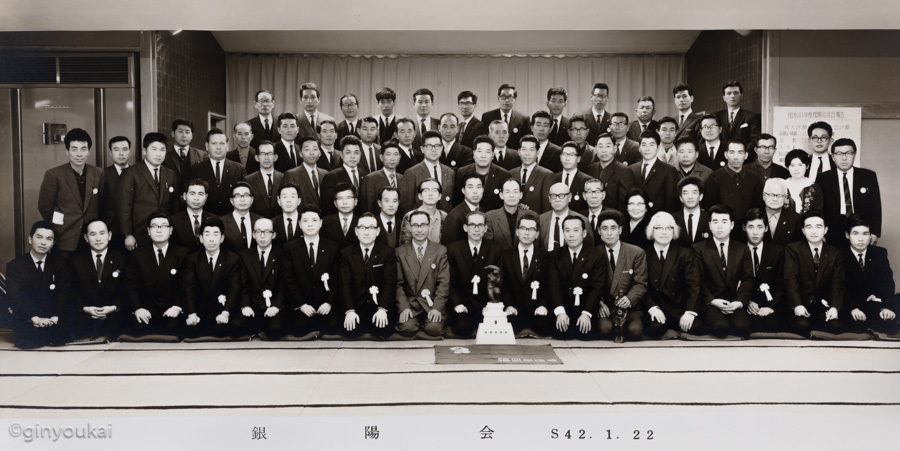
This screenshot has width=900, height=451. I want to click on trophy, so click(490, 338).